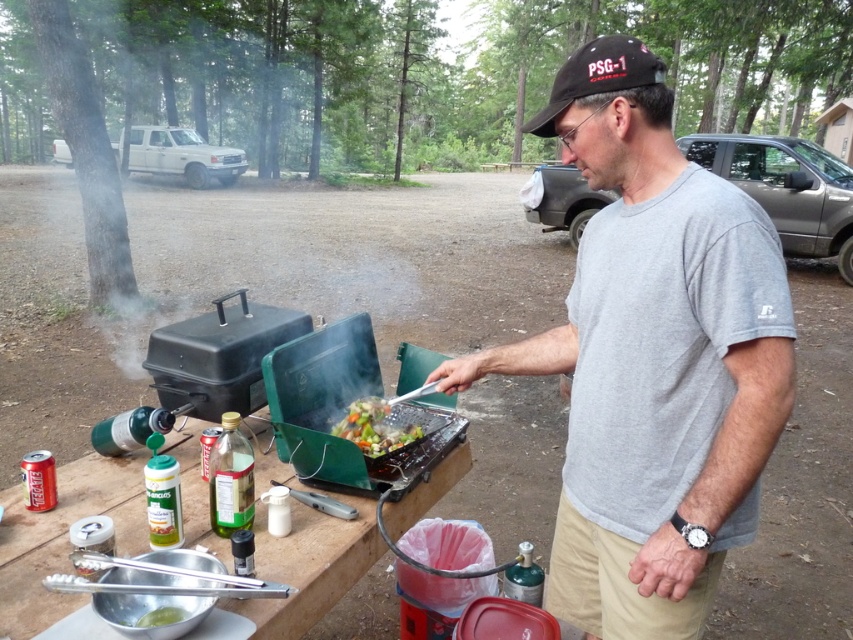
Question: Can you confirm if gray cotton t-shirt at center is wider than wooden table at center?

Choices:
 (A) yes
 (B) no

Answer: (B)

Question: Based on their relative distances, which object is nearer to the gray cotton t-shirt at center?

Choices:
 (A) wooden table at center
 (B) vibrant mixed vegetables at center

Answer: (B)

Question: Does wooden table at center have a lesser width compared to vibrant mixed vegetables at center?

Choices:
 (A) no
 (B) yes

Answer: (A)

Question: Observing the image, what is the correct spatial positioning of wooden table at center in reference to vibrant mixed vegetables at center?

Choices:
 (A) left
 (B) right

Answer: (A)

Question: Which of the following is the farthest from the observer?

Choices:
 (A) (41, 547)
 (B) (567, 493)
 (C) (402, 438)

Answer: (C)

Question: Among these points, which one is farthest from the camera?

Choices:
 (A) coord(585,602)
 (B) coord(352,440)
 (C) coord(86,500)

Answer: (B)